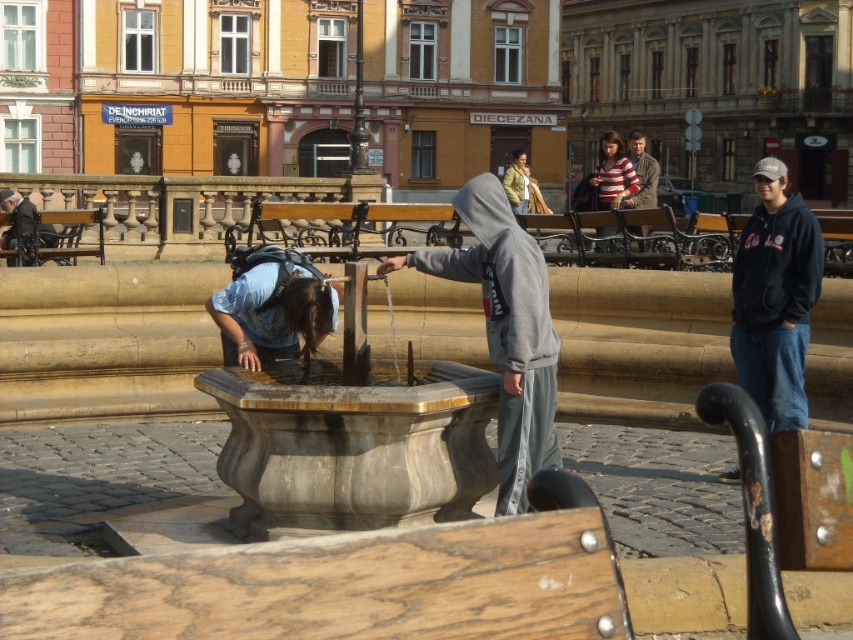
Question: Is gray hoodie at center smaller than striped sweater at center?

Choices:
 (A) no
 (B) yes

Answer: (B)

Question: Estimate the real-world distances between objects in this image. Which object is closer to the brushed metal water fountain at left?

Choices:
 (A) blue denim shirt at lower left
 (B) striped cotton shirt at center

Answer: (A)

Question: Which is farther from the dark blue hoodie at right?

Choices:
 (A) striped cotton shirt at center
 (B) striped sweater at center
 (C) blue denim shirt at lower left
 (D) brushed metal water fountain at left

Answer: (D)

Question: Does gray hoodie at center come in front of dark blue hoodie at right?

Choices:
 (A) yes
 (B) no

Answer: (B)

Question: Which point is closer to the camera?

Choices:
 (A) brushed metal water fountain at left
 (B) blue denim shirt at lower left
 (C) gray hoodie at center
 (D) dark blue hoodie at right

Answer: (D)

Question: Does striped sweater at center have a larger size compared to brushed metal water fountain at left?

Choices:
 (A) no
 (B) yes

Answer: (B)